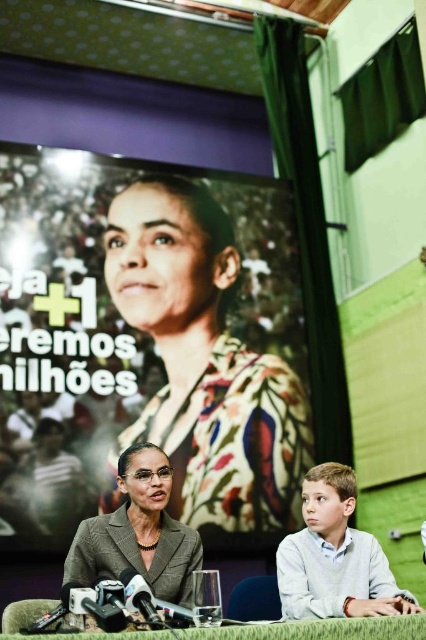
Question: Does light gray cotton shirt at lower right have a greater width compared to gray textured blazer at center?

Choices:
 (A) yes
 (B) no

Answer: (B)

Question: Which object is positioned farthest from the gray textured blazer at center?

Choices:
 (A) green fabric table at lower center
 (B) floral-patterned shirt at center
 (C) light gray cotton shirt at lower right

Answer: (B)

Question: Which object is the farthest from the green fabric table at lower center?

Choices:
 (A) gray textured blazer at center
 (B) floral-patterned shirt at center
 (C) light gray cotton shirt at lower right

Answer: (B)

Question: Does gray textured blazer at center have a larger size compared to green fabric table at lower center?

Choices:
 (A) no
 (B) yes

Answer: (B)

Question: Does light gray cotton shirt at lower right come behind green fabric table at lower center?

Choices:
 (A) yes
 (B) no

Answer: (A)

Question: Estimate the real-world distances between objects in this image. Which object is farther from the floral-patterned shirt at center?

Choices:
 (A) light gray cotton shirt at lower right
 (B) green fabric table at lower center
 (C) gray textured blazer at center

Answer: (B)